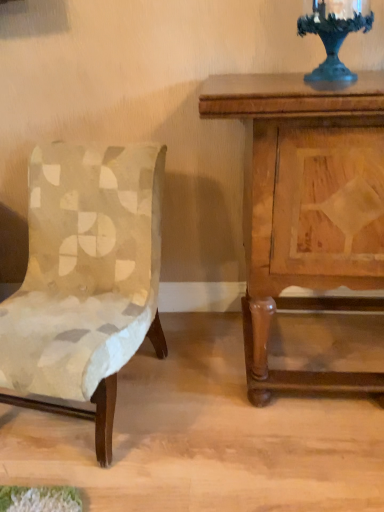
Image resolution: width=384 pixels, height=512 pixels. What are the coordinates of `wooden nightstand at right` in the screenshot? It's located at (307, 210).

Measure the distance between point (379, 157) and camera.

Point (379, 157) and camera are 31.93 inches apart.

Find the location of a particular element. This screenshot has width=384, height=512. velvet beige chair at left is located at coordinates (85, 279).

Which is correct: wooden nightstand at right is inside metallic dark blue candle holder at upper right, or outside of it?

wooden nightstand at right is not enclosed by metallic dark blue candle holder at upper right.

From a real-world perspective, between wooden nightstand at right and metallic dark blue candle holder at upper right, who is vertically higher?

In real-world perspective, metallic dark blue candle holder at upper right is above.

Does wooden nightstand at right have a greater height compared to metallic dark blue candle holder at upper right?

Correct, wooden nightstand at right is much taller as metallic dark blue candle holder at upper right.

Is point (375, 308) closer or farther from the camera than point (324, 69)?

Point (375, 308) appears to be farther away from the viewer than point (324, 69).

From the picture: Which of these two, metallic dark blue candle holder at upper right or velvet beige chair at left, stands shorter?

metallic dark blue candle holder at upper right is shorter.

Can you confirm if metallic dark blue candle holder at upper right is positioned to the left of velvet beige chair at left?

No, metallic dark blue candle holder at upper right is not to the left of velvet beige chair at left.

Does metallic dark blue candle holder at upper right lie behind velvet beige chair at left?

Yes, metallic dark blue candle holder at upper right is further from the camera.

At what (x,y) coordinates should I click in order to perform the action: click on candle holder behind the velvet beige chair at left. Please return your answer as a coordinate pair (x, y). The image size is (384, 512). Looking at the image, I should click on (334, 34).

From a real-world perspective, which object rests below the other?

From a 3D spatial view, velvet beige chair at left is below.

From the image's perspective, is velvet beige chair at left beneath metallic dark blue candle holder at upper right?

Indeed, from the image's perspective, velvet beige chair at left is shown beneath metallic dark blue candle holder at upper right.

Who is smaller, velvet beige chair at left or metallic dark blue candle holder at upper right?

metallic dark blue candle holder at upper right is smaller.

Can you confirm if velvet beige chair at left is positioned to the right of metallic dark blue candle holder at upper right?

No.

How many degrees apart are the facing directions of wooden nightstand at right and velvet beige chair at left?

They differ by 10.9 degrees in their facing directions.

You are a GUI agent. You are given a task and a screenshot of the screen. Output one action in this format:
    pyautogui.click(x=<x>, y=<y>)
    Task: Click on the chair below the wooden nightstand at right (from the image's perspective)
    This screenshot has height=512, width=384.
    Given the screenshot: What is the action you would take?
    pyautogui.click(x=85, y=279)

From the image's perspective, is wooden nightstand at right located above or below velvet beige chair at left?

From the image's perspective, wooden nightstand at right appears above velvet beige chair at left.

Between metallic dark blue candle holder at upper right and wooden nightstand at right, which one has less height?

Standing shorter between the two is metallic dark blue candle holder at upper right.

From the image's perspective, is metallic dark blue candle holder at upper right on top of wooden nightstand at right?

Yes, from the image's perspective, metallic dark blue candle holder at upper right is over wooden nightstand at right.

Would you say metallic dark blue candle holder at upper right is a long distance from wooden nightstand at right?

No, metallic dark blue candle holder at upper right is not far away from wooden nightstand at right.

Considering the sizes of objects metallic dark blue candle holder at upper right and wooden nightstand at right in the image provided, who is wider, metallic dark blue candle holder at upper right or wooden nightstand at right?

wooden nightstand at right.

Locate an element on the screen. nightstand on the right of velvet beige chair at left is located at coordinates (307, 210).

From the picture: Is there a large distance between velvet beige chair at left and wooden nightstand at right?

velvet beige chair at left is near wooden nightstand at right, not far away.

Considering the relative sizes of velvet beige chair at left and wooden nightstand at right in the image provided, is velvet beige chair at left wider than wooden nightstand at right?

Indeed, velvet beige chair at left has a greater width compared to wooden nightstand at right.

Looking at this image, does velvet beige chair at left turn towards wooden nightstand at right?

No, velvet beige chair at left does not turn towards wooden nightstand at right.

You are a GUI agent. You are given a task and a screenshot of the screen. Output one action in this format:
    pyautogui.click(x=<x>, y=<y>)
    Task: Click on the candle holder above the wooden nightstand at right (from the image's perspective)
    The height and width of the screenshot is (512, 384).
    Given the screenshot: What is the action you would take?
    pyautogui.click(x=334, y=34)

Identify the location of candle holder behind the velvet beige chair at left. The image size is (384, 512). (334, 34).

From the image, which object appears to be farther from metallic dark blue candle holder at upper right, wooden nightstand at right or velvet beige chair at left?

velvet beige chair at left lies further to metallic dark blue candle holder at upper right than the other object.

Estimate the real-world distances between objects in this image. Which object is further from metallic dark blue candle holder at upper right, velvet beige chair at left or wooden nightstand at right?

Among the two, velvet beige chair at left is located further to metallic dark blue candle holder at upper right.

Considering their positions, is wooden nightstand at right positioned closer to velvet beige chair at left than metallic dark blue candle holder at upper right?

wooden nightstand at right lies closer to velvet beige chair at left than the other object.

When comparing their distances from velvet beige chair at left, does metallic dark blue candle holder at upper right or wooden nightstand at right seem further?

The object further to velvet beige chair at left is metallic dark blue candle holder at upper right.

Based on the photo, from the image, which object appears to be farther from wooden nightstand at right, velvet beige chair at left or metallic dark blue candle holder at upper right?

The object further to wooden nightstand at right is velvet beige chair at left.

Looking at the image, which one is located further to wooden nightstand at right, metallic dark blue candle holder at upper right or velvet beige chair at left?

velvet beige chair at left is positioned further to the anchor wooden nightstand at right.

The width and height of the screenshot is (384, 512). I want to click on candle holder between velvet beige chair at left and wooden nightstand at right, so click(334, 34).